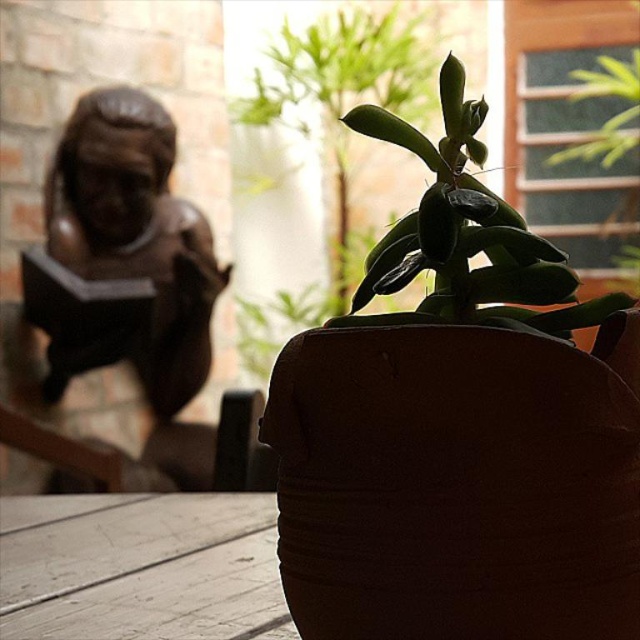
You are a photographer trying to capture the bronze statue at left and the green matte succulent at center in a balanced composition. Which object should you adjust the camera focus on to ensure the wider one is sharp?

The bronze statue at left is wider than the green matte succulent at center. To ensure the wider object is sharp, focus on the bronze statue at left.

You are standing in a garden and see the white wood table at lower left. If you want to place a 12 inch tall vase on it, will there be enough space?

The distance between you and the white wood table at lower left is 34.51 inches. Since the vase is only 12 inches tall, there is sufficient space to place it on the table.

You are standing in a garden and want to place a small vase on the white wood table at lower left. However, you notice the green matte succulent at center is blocking your view of the table. Can you still reach the table without moving the succulent?

The white wood table at lower left is further to the viewer than the green matte succulent at center, so the succulent is closer to you. Since the succulent is in front of the table, you can still reach the table without moving the succulent because it is behind the plant.